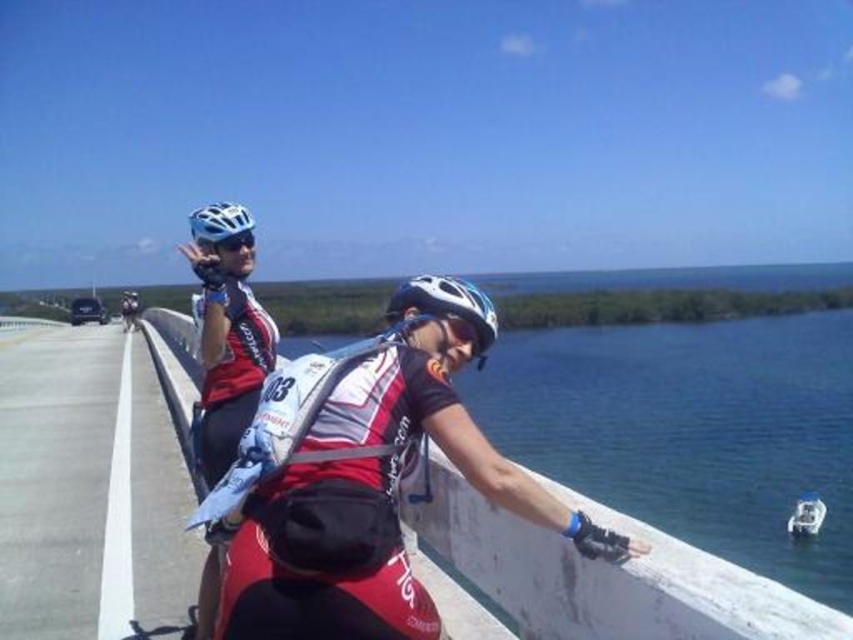
Question: Which object is positioned closest to the clear blue water at center?

Choices:
 (A) white matte bicycle helmet at center
 (B) white matte bicycle helmet at upper center
 (C) concrete at left

Answer: (C)

Question: Is concrete at left to the right of white matte bicycle helmet at center from the viewer's perspective?

Choices:
 (A) no
 (B) yes

Answer: (A)

Question: Estimate the real-world distances between objects in this image. Which object is farther from the white matte bicycle helmet at center?

Choices:
 (A) clear blue water at center
 (B) concrete at left

Answer: (B)

Question: Which object appears closest to the camera in this image?

Choices:
 (A) white matte bicycle helmet at upper center
 (B) matte black helmet at upper left
 (C) white matte bicycle helmet at center
 (D) concrete at left

Answer: (C)

Question: Does clear blue water at center have a larger size compared to white matte bicycle helmet at center?

Choices:
 (A) yes
 (B) no

Answer: (A)

Question: Considering the relative positions of clear blue water at center and white matte bicycle helmet at upper center in the image provided, where is clear blue water at center located with respect to white matte bicycle helmet at upper center?

Choices:
 (A) below
 (B) above

Answer: (A)